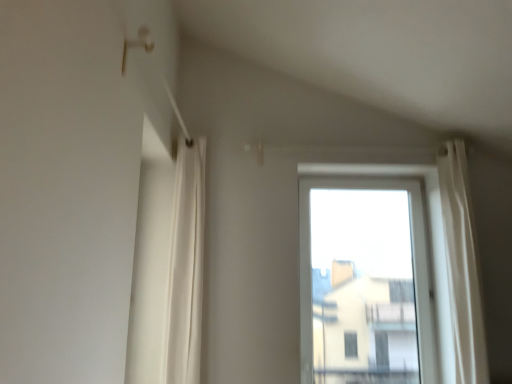
Describe the element at coordinates (186, 267) in the screenshot. I see `white fabric curtain at left` at that location.

The width and height of the screenshot is (512, 384). I want to click on white fabric curtain at left, so click(x=186, y=267).

What are the coordinates of `transparent glass window at center` in the screenshot? It's located at (366, 275).

Describe the element at coordinates (366, 275) in the screenshot. Image resolution: width=512 pixels, height=384 pixels. I see `transparent glass window at center` at that location.

The height and width of the screenshot is (384, 512). Identify the location of white fabric curtain at left. (186, 267).

Does transparent glass window at center appear on the left side of white fabric curtain at left?

Incorrect, transparent glass window at center is not on the left side of white fabric curtain at left.

Does transparent glass window at center come behind white fabric curtain at left?

Yes, it is behind white fabric curtain at left.

Does point (396, 216) lie in front of point (175, 358)?

That is False.

In the scene shown: From the image's perspective, which one is positioned higher, transparent glass window at center or white fabric curtain at left?

white fabric curtain at left.

From a real-world perspective, between transparent glass window at center and white fabric curtain at left, who is vertically lower?

transparent glass window at center, from a real-world perspective.

Which of these two, transparent glass window at center or white fabric curtain at left, is thinner?

Thinner between the two is transparent glass window at center.

Is transparent glass window at center shorter than white fabric curtain at left?

Correct, transparent glass window at center is not as tall as white fabric curtain at left.

Between transparent glass window at center and white fabric curtain at left, which one has larger size?

transparent glass window at center.

Does transparent glass window at center contain white fabric curtain at left?

No, white fabric curtain at left is not inside transparent glass window at center.

Is transparent glass window at center next to white fabric curtain at left and touching it?

No, transparent glass window at center is not making contact with white fabric curtain at left.

Is transparent glass window at center aimed at white fabric curtain at left?

No, transparent glass window at center is not aimed at white fabric curtain at left.

How different are the orientations of transparent glass window at center and white fabric curtain at left in degrees?

There is a 94-degree angle between the facing directions of transparent glass window at center and white fabric curtain at left.

This screenshot has width=512, height=384. What are the coordinates of `window that appears on the right of white fabric curtain at left` in the screenshot? It's located at (366, 275).

Which object is positioned more to the right, white fabric curtain at left or transparent glass window at center?

transparent glass window at center is more to the right.

Is white fabric curtain at left positioned behind transparent glass window at center?

No, it is not.

Which point is more distant from viewer, (178, 195) or (421, 308)?

The point (421, 308) is farther.

From the image's perspective, which one is positioned higher, white fabric curtain at left or transparent glass window at center?

white fabric curtain at left appears higher in the image.

From a real-world perspective, does white fabric curtain at left stand above transparent glass window at center?

Indeed, from a real-world perspective, white fabric curtain at left stands above transparent glass window at center.

Considering the sizes of white fabric curtain at left and transparent glass window at center in the image, is white fabric curtain at left wider or thinner than transparent glass window at center?

white fabric curtain at left is wider than transparent glass window at center.

Does white fabric curtain at left have a lesser height compared to transparent glass window at center?

No.

Looking at the image, does white fabric curtain at left seem bigger or smaller compared to transparent glass window at center?

In the image, white fabric curtain at left appears to be smaller than transparent glass window at center.

Is white fabric curtain at left positioned beyond the bounds of transparent glass window at center?

white fabric curtain at left lies outside transparent glass window at center's area.

Is white fabric curtain at left next to transparent glass window at center?

No, white fabric curtain at left is not in contact with transparent glass window at center.

Is white fabric curtain at left facing towards transparent glass window at center?

No, white fabric curtain at left does not turn towards transparent glass window at center.

How many degrees apart are the facing directions of white fabric curtain at left and transparent glass window at center?

94 degrees separate the facing orientations of white fabric curtain at left and transparent glass window at center.

Find the location of a particular element. window below the white fabric curtain at left (from the image's perspective) is located at coordinates pos(366,275).

This screenshot has width=512, height=384. In the image, there is a white fabric curtain at left. In order to click on window below it (from a real-world perspective) in this screenshot , I will do `click(366, 275)`.

This screenshot has width=512, height=384. In order to click on window on the right of white fabric curtain at left in this screenshot , I will do `click(366, 275)`.